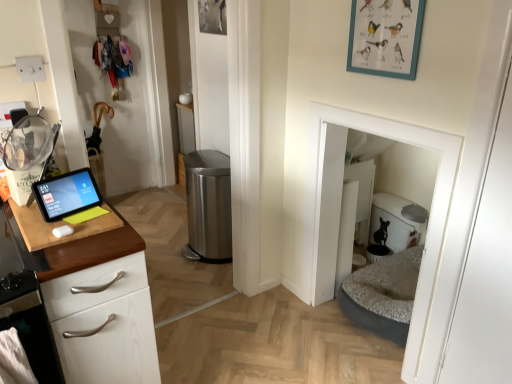
Question: Is teal matte picture frame at upper center wider or thinner than white matte door at center?

Choices:
 (A) wide
 (B) thin

Answer: (B)

Question: Considering the relative positions of teal matte picture frame at upper center and white matte door at center in the image provided, is teal matte picture frame at upper center to the left or to the right of white matte door at center?

Choices:
 (A) left
 (B) right

Answer: (A)

Question: Estimate the real-world distances between objects in this image. Which object is closer to the light wood/white cabinetry at left?

Choices:
 (A) wooden cutting board at left
 (B) teal matte picture frame at upper center
 (C) white matte door at center
 (D) polished stainless steel trash can at center
 (E) black glossy tablet at left

Answer: (A)

Question: Estimate the real-world distances between objects in this image. Which object is farther from the light wood/white cabinetry at left?

Choices:
 (A) polished stainless steel trash can at center
 (B) wooden cutting board at left
 (C) white matte door at center
 (D) teal matte picture frame at upper center
 (E) black glossy tablet at left

Answer: (A)